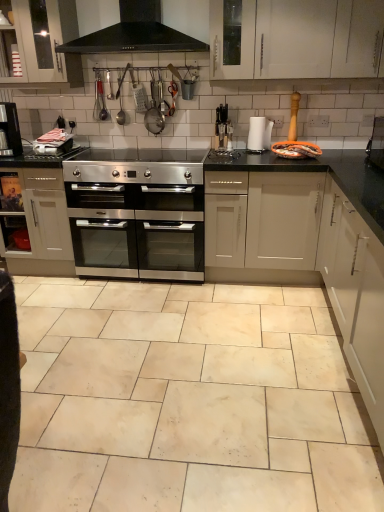
Locate an element on the screen. The image size is (384, 512). vacant area that is in front of stainless steel oven at center is located at coordinates (136, 313).